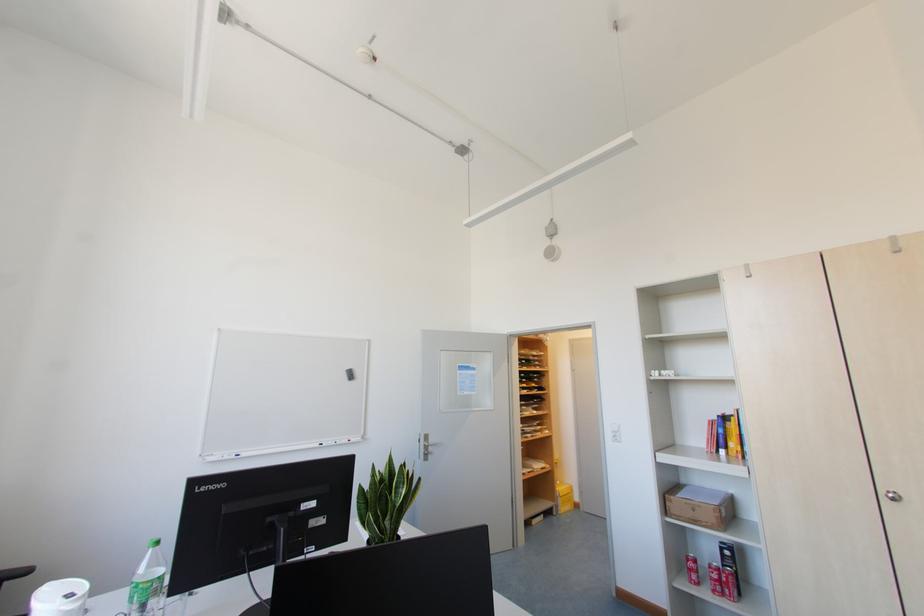
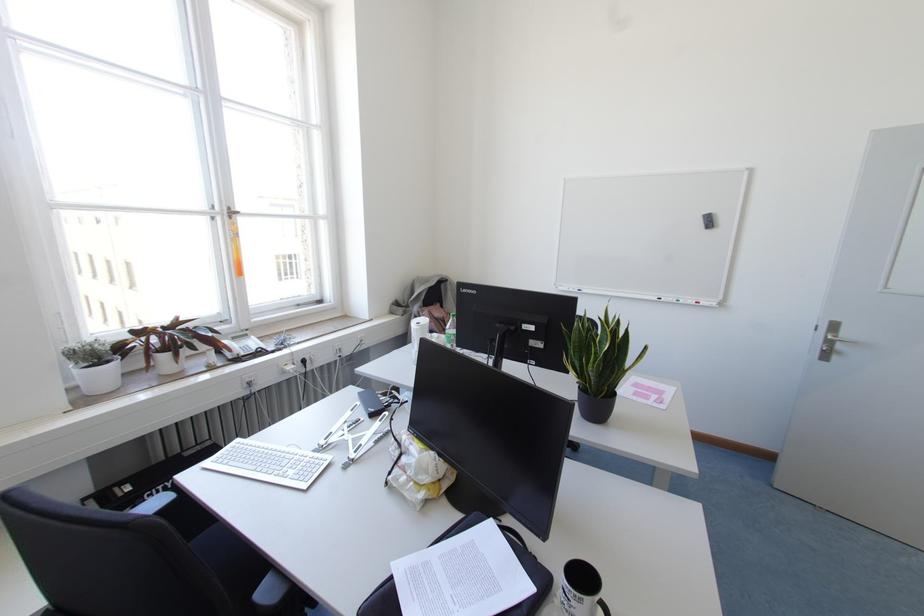
Where in the second image is the point corresponding to point (237, 455) from the first image?

(578, 290)